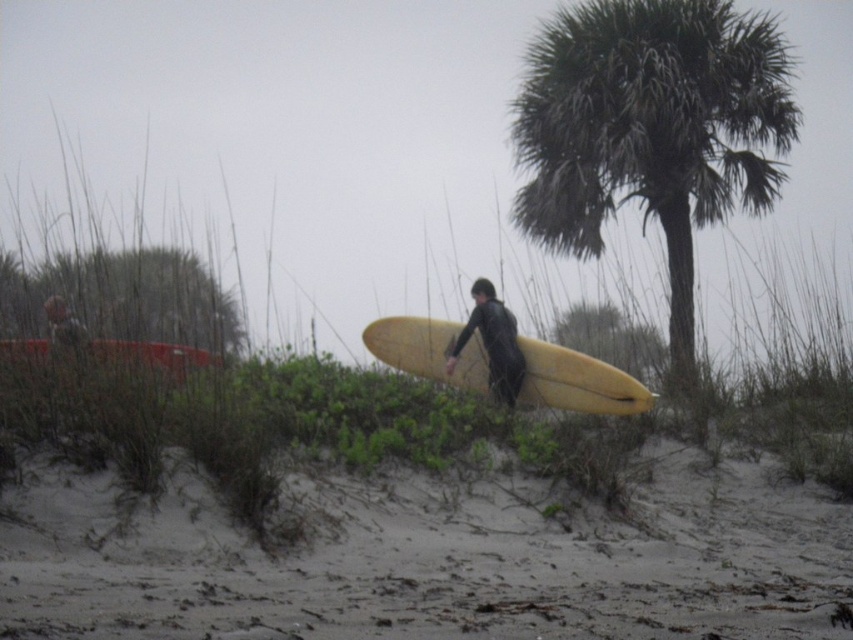
Question: Can you confirm if yellow matte surfboard at center is wider than matte black wetsuit at center?

Choices:
 (A) yes
 (B) no

Answer: (A)

Question: Which object is positioned farthest from the matte black wetsuit at center?

Choices:
 (A) yellow matte surfboard at lower center
 (B) green leafy palm tree at upper right
 (C) smooth sand at lower center
 (D) yellow matte surfboard at center

Answer: (B)

Question: Does smooth sand at lower center have a greater width compared to yellow matte surfboard at lower center?

Choices:
 (A) yes
 (B) no

Answer: (B)

Question: Which point is farther from the camera taking this photo?

Choices:
 (A) (674, 227)
 (B) (589, 397)

Answer: (A)

Question: Is green leafy palm tree at upper right wider than yellow matte surfboard at center?

Choices:
 (A) no
 (B) yes

Answer: (A)

Question: Considering the real-world distances, which object is closest to the smooth sand at lower center?

Choices:
 (A) yellow matte surfboard at center
 (B) green leafy palm tree at upper right
 (C) yellow matte surfboard at lower center
 (D) matte black wetsuit at center

Answer: (C)